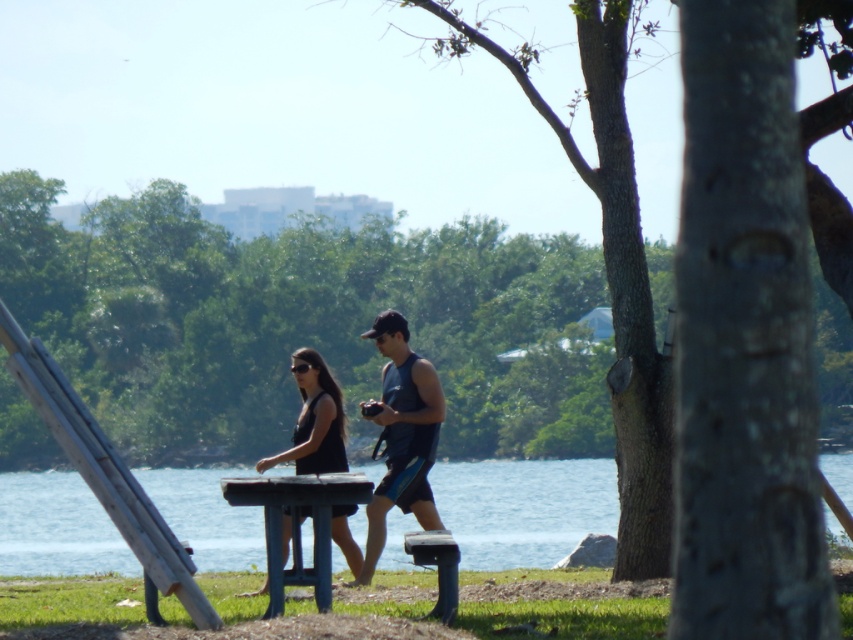
Can you confirm if blue water at center is wider than wooden park bench at center?

Correct, the width of blue water at center exceeds that of wooden park bench at center.

Is blue water at center in front of wooden park bench at center?

No, blue water at center is behind wooden park bench at center.

Who is more distant from viewer, (x=506, y=502) or (x=438, y=564)?

The point (x=506, y=502) is more distant.

Where is `blue water at center`? blue water at center is located at coordinates (523, 508).

Is point (395, 324) closer to viewer compared to point (444, 544)?

No, it is not.

This screenshot has width=853, height=640. Identify the location of dark blue tank top at center. (402, 435).

Is brushed metal ladder at left smaller than wooden park bench at center?

Yes.

Is brushed metal ladder at left taller than wooden park bench at center?

Incorrect, brushed metal ladder at left's height is not larger of wooden park bench at center's.

The image size is (853, 640). What are the coordinates of `brushed metal ladder at left` in the screenshot? It's located at (103, 472).